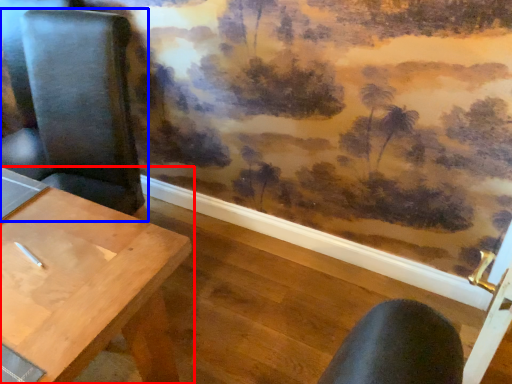
Question: Which of the following is the closest to the observer, table (highlighted by a red box) or chair (highlighted by a blue box)?

Choices:
 (A) table
 (B) chair

Answer: (A)